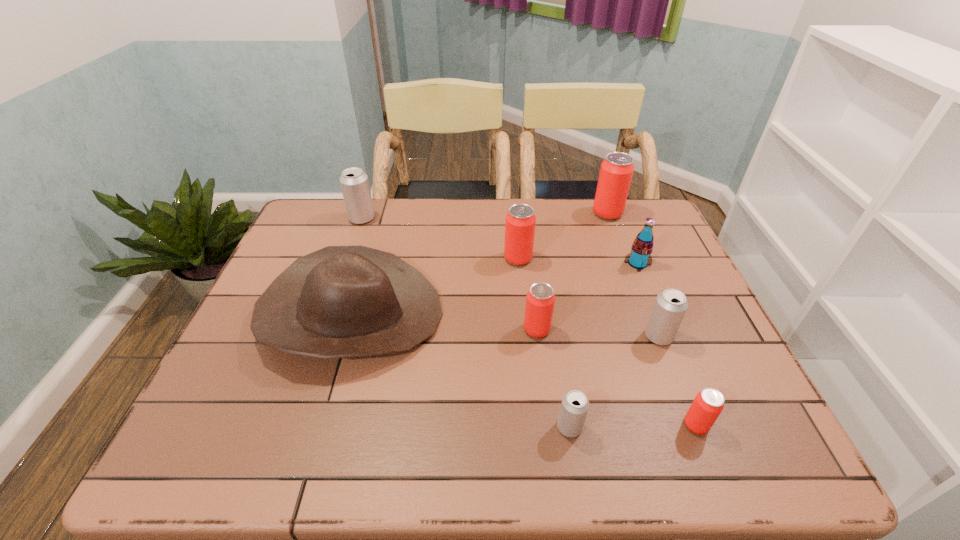
Where is `free space located 0.110m on the right of the second smallest red beer can`? Image resolution: width=960 pixels, height=540 pixels. free space located 0.110m on the right of the second smallest red beer can is located at coordinates pyautogui.click(x=596, y=330).

Find the location of a particular element. vacant space located on the back of the smallest white beer can is located at coordinates (553, 324).

At what (x,y) coordinates should I click in order to perform the action: click on free spot located 0.350m on the left of the nearest red beer can. Please return your answer as a coordinate pair (x, y). The width and height of the screenshot is (960, 540). Looking at the image, I should click on (508, 425).

At what (x,y) coordinates should I click in order to perform the action: click on beer can present at the left edge. Please return your answer as a coordinate pair (x, y). Looking at the image, I should click on (354, 183).

The width and height of the screenshot is (960, 540). Identify the location of cowboy hat that is at the left edge. (340, 301).

In order to click on soda located at the right edge in this screenshot , I will do `click(639, 258)`.

The image size is (960, 540). Find the location of `object positioned at the far left corner`. object positioned at the far left corner is located at coordinates (354, 183).

Locate an element on the screen. object located at the far right corner is located at coordinates (616, 171).

Where is `object that is at the near right corner`? The height and width of the screenshot is (540, 960). object that is at the near right corner is located at coordinates (708, 404).

Locate an element on the screen. free spot at the far edge of the desktop is located at coordinates (444, 222).